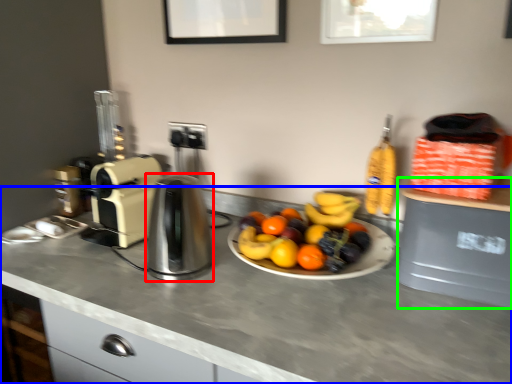
Question: Considering the real-world distances, which object is closest to kitchen appliance (highlighted by a red box)? countertop (highlighted by a blue box) or appliance (highlighted by a green box).

Choices:
 (A) countertop
 (B) appliance

Answer: (A)